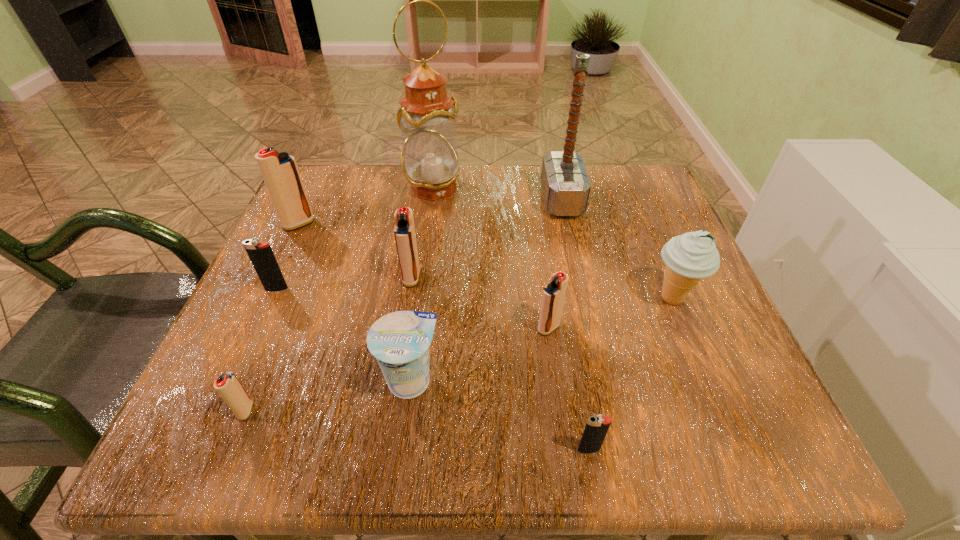
Identify the location of the bigger black igniter. The image size is (960, 540). (261, 255).

Find the location of `the third farthest red igniter`. the third farthest red igniter is located at coordinates (553, 295).

Identify the location of the fourth nearest object. The image size is (960, 540). tap(553, 295).

What are the coordinates of `blue yogurt` in the screenshot? It's located at (400, 341).

The width and height of the screenshot is (960, 540). Find the location of `the third igniter from left to right`. the third igniter from left to right is located at coordinates (228, 386).

Where is `the eighth object from right to left`? the eighth object from right to left is located at coordinates (228, 386).

You are a GUI agent. You are given a task and a screenshot of the screen. Output one action in this format:
    pyautogui.click(x=<x>, y=<y>)
    Task: Click on the nearest object
    
    Given the screenshot: What is the action you would take?
    pyautogui.click(x=597, y=426)

Find the location of a particular element. Image resolution: width=960 pixels, height=540 pixels. the right black igniter is located at coordinates (597, 426).

This screenshot has height=540, width=960. Find the location of `free space located 0.170m on the left of the oil lamp`. free space located 0.170m on the left of the oil lamp is located at coordinates (333, 188).

Find the location of a particular element. free space located 0.200m on the striking surface of the brown hammer is located at coordinates (455, 200).